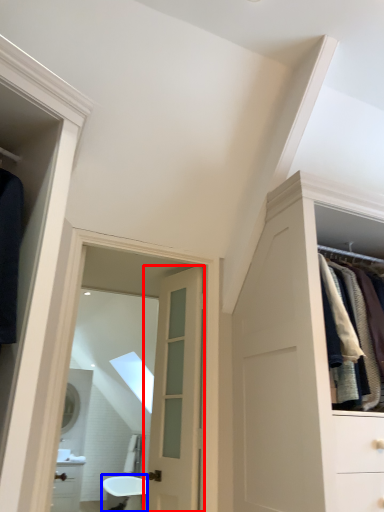
Question: Which object is further to the camera taking this photo, door (highlighted by a red box) or bath (highlighted by a blue box)?

Choices:
 (A) door
 (B) bath

Answer: (B)